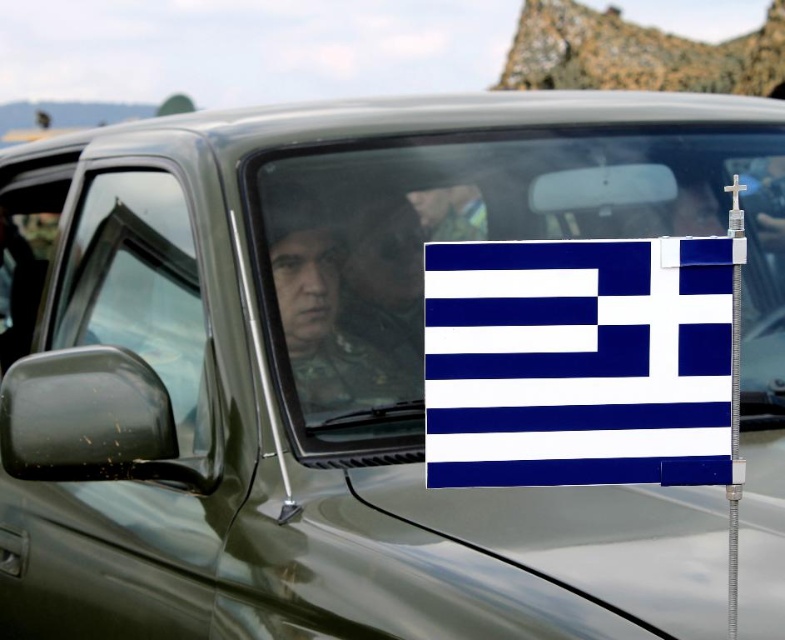
Is point (714, 316) closer to viewer compared to point (97, 250)?

Yes, point (714, 316) is closer to viewer.

Who is positioned more to the right, blue fabric flag at center or transparent glass window at left?

blue fabric flag at center is more to the right.

The height and width of the screenshot is (640, 785). In order to click on blue fabric flag at center in this screenshot , I will do `click(579, 362)`.

Does blue fabric flag at center have a lesser height compared to matte black uniform at center?

Correct, blue fabric flag at center is not as tall as matte black uniform at center.

Consider the image. Who is positioned more to the right, blue fabric flag at center or matte black uniform at center?

blue fabric flag at center

Measure the distance between point (x=535, y=321) and camera.

The distance of point (x=535, y=321) from camera is 4.45 feet.

Identify the location of blue fabric flag at center. (579, 362).

Between white matte flag at center and blue fabric flag at center, which one has less height?

With less height is blue fabric flag at center.

Is white matte flag at center further to camera compared to blue fabric flag at center?

Yes, it is behind blue fabric flag at center.

Who is more distant from viewer, (362, 436) or (612, 362)?

The point (362, 436) is behind.

This screenshot has height=640, width=785. I want to click on white matte flag at center, so click(x=479, y=240).